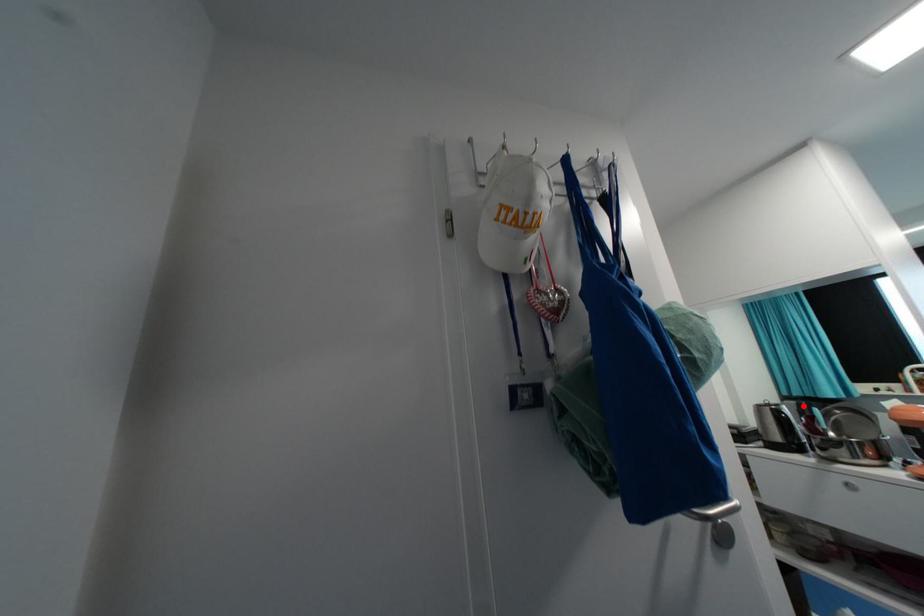
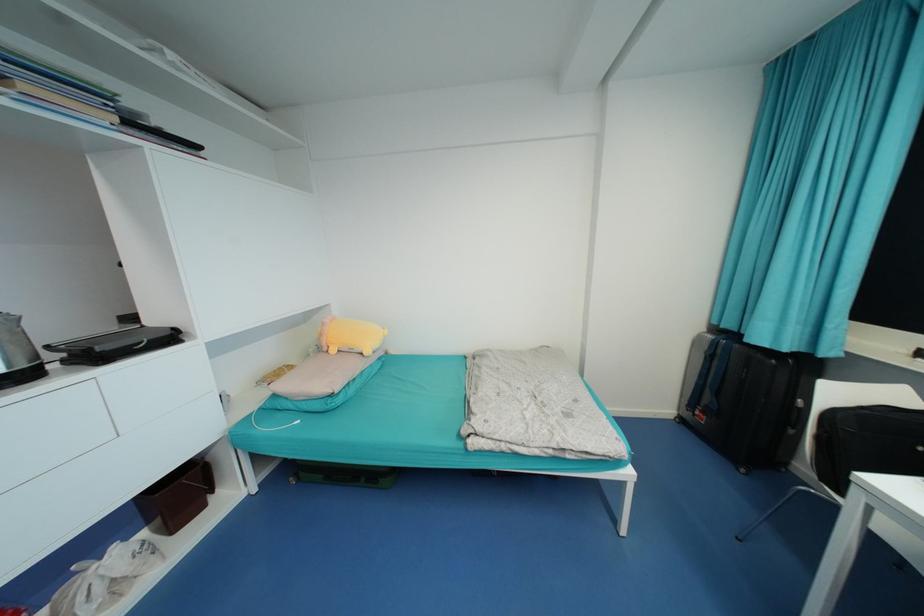
Find the pixel in the second image that matches the highlighted location in the first image.

(719, 345)